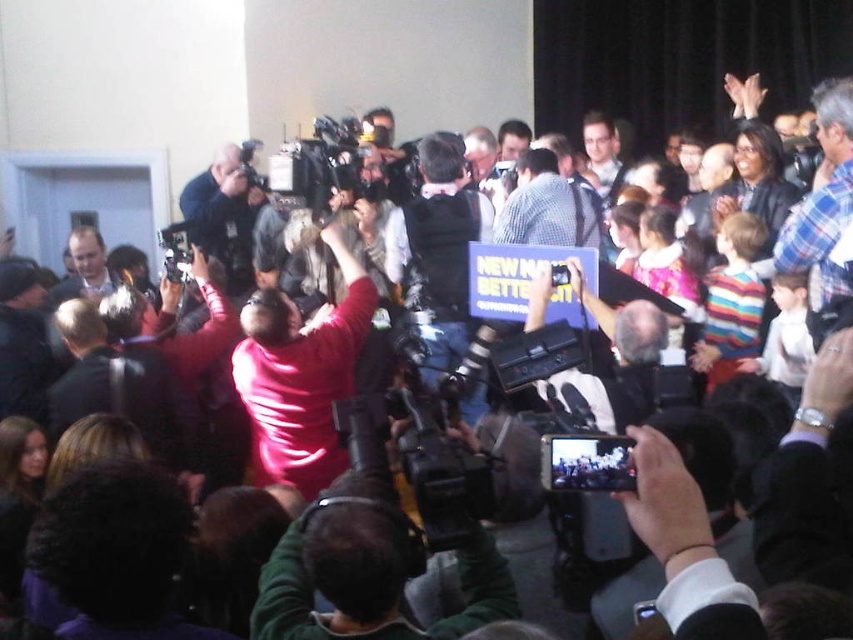
Question: Is matte pink shirt at center to the left of black plastic video camera at center from the viewer's perspective?

Choices:
 (A) no
 (B) yes

Answer: (B)

Question: Which of the following is the closest to the observer?

Choices:
 (A) (578, 452)
 (B) (282, 323)

Answer: (A)

Question: Considering the relative positions of matte pink shirt at center and black plastic video camera at center in the image provided, where is matte pink shirt at center located with respect to black plastic video camera at center?

Choices:
 (A) right
 (B) left

Answer: (B)

Question: Which object is closer to the camera taking this photo?

Choices:
 (A) black plastic video camera at center
 (B) matte pink shirt at center

Answer: (A)

Question: Can you confirm if matte pink shirt at center is positioned above black plastic video camera at center?

Choices:
 (A) yes
 (B) no

Answer: (A)